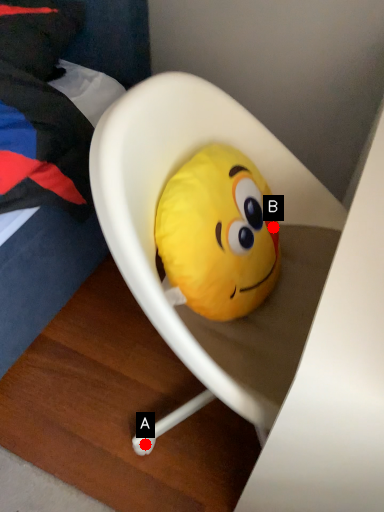
Question: Two points are circled on the image, labeled by A and B beside each circle. Which point is farther from the camera taking this photo?

Choices:
 (A) A is further
 (B) B is further

Answer: (A)